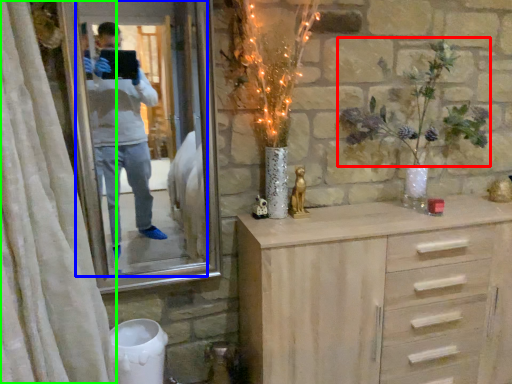
Question: Considering the real-world distances, which object is closest to floral arrangement (highlighted by a red box)? mirror (highlighted by a blue box) or curtain (highlighted by a green box).

Choices:
 (A) mirror
 (B) curtain

Answer: (B)